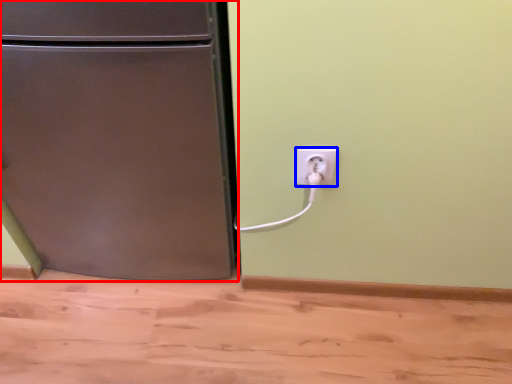
Question: Which object appears farthest to the camera in this image, refrigerator (highlighted by a red box) or power plugs and sockets (highlighted by a blue box)?

Choices:
 (A) refrigerator
 (B) power plugs and sockets

Answer: (B)